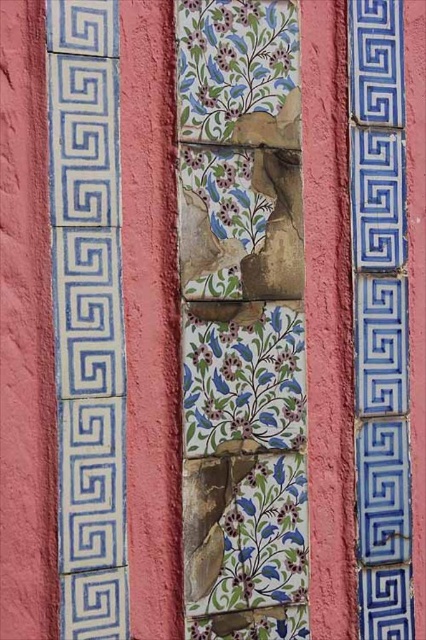
From the picture: Can you confirm if floral painted tiles at center is positioned to the left of blue glossy tile at left?

Incorrect, floral painted tiles at center is not on the left side of blue glossy tile at left.

Locate an element on the screen. This screenshot has width=426, height=640. floral painted tiles at center is located at coordinates (241, 320).

Based on the photo, does floral painted tiles at center appear under blue glossy tile at right?

Yes, floral painted tiles at center is below blue glossy tile at right.

Is floral painted tiles at center above blue glossy tile at right?

Actually, floral painted tiles at center is below blue glossy tile at right.

Describe the element at coordinates (241, 320) in the screenshot. The image size is (426, 640). I see `floral painted tiles at center` at that location.

Find the location of `floral painted tiles at center`. floral painted tiles at center is located at coordinates (241, 320).

Between blue glossy tile at left and blue glossy tile at right, which one has less height?

blue glossy tile at left is shorter.

Is blue glossy tile at left to the left of blue glossy tile at right from the viewer's perspective?

Correct, you'll find blue glossy tile at left to the left of blue glossy tile at right.

Who is more forward, (x=109, y=19) or (x=379, y=394)?

Point (x=109, y=19)

The height and width of the screenshot is (640, 426). What are the coordinates of `blue glossy tile at left` in the screenshot? It's located at (88, 316).